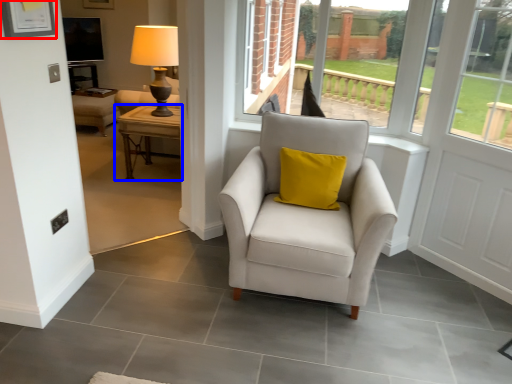
Question: Which point is further to the camera, picture frame (highlighted by a red box) or table (highlighted by a blue box)?

Choices:
 (A) picture frame
 (B) table

Answer: (B)